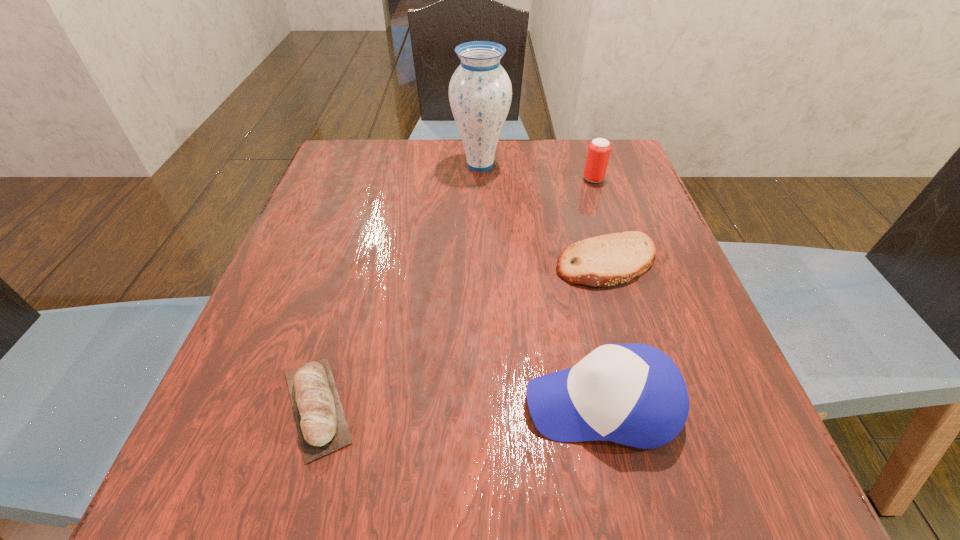
Image resolution: width=960 pixels, height=540 pixels. I want to click on free space between the left pita bread and the tallest object, so click(x=398, y=286).

Locate an element on the screen. The width and height of the screenshot is (960, 540). object that stands as the fourth closest to the farther pita bread is located at coordinates (322, 427).

Choose which object is the second nearest neighbor to the beer can. Please provide its 2D coordinates. Your answer should be formatted as a tuple, i.e. [(x, y)], where the tuple contains the x and y coordinates of a point satisfying the conditions above.

[(607, 260)]